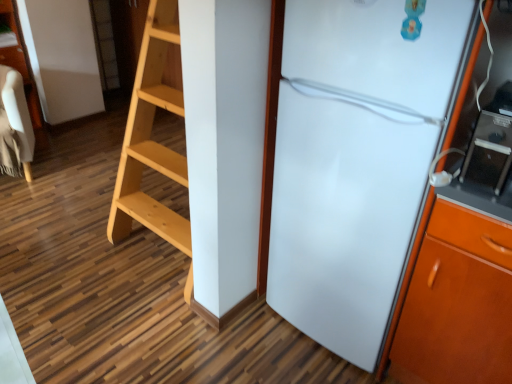
Question: Based on their sizes in the image, would you say black glossy microwave at right is bigger or smaller than beige fabric chair at left?

Choices:
 (A) small
 (B) big

Answer: (A)

Question: Is black glossy microwave at right wider or thinner than beige fabric chair at left?

Choices:
 (A) thin
 (B) wide

Answer: (A)

Question: Estimate the real-world distances between objects in this image. Which object is farther from the beige fabric chair at left?

Choices:
 (A) white glossy refrigerator at right
 (B) black glossy microwave at right

Answer: (B)

Question: Which object is the farthest from the white glossy refrigerator at right?

Choices:
 (A) beige fabric chair at left
 (B) black glossy microwave at right

Answer: (A)